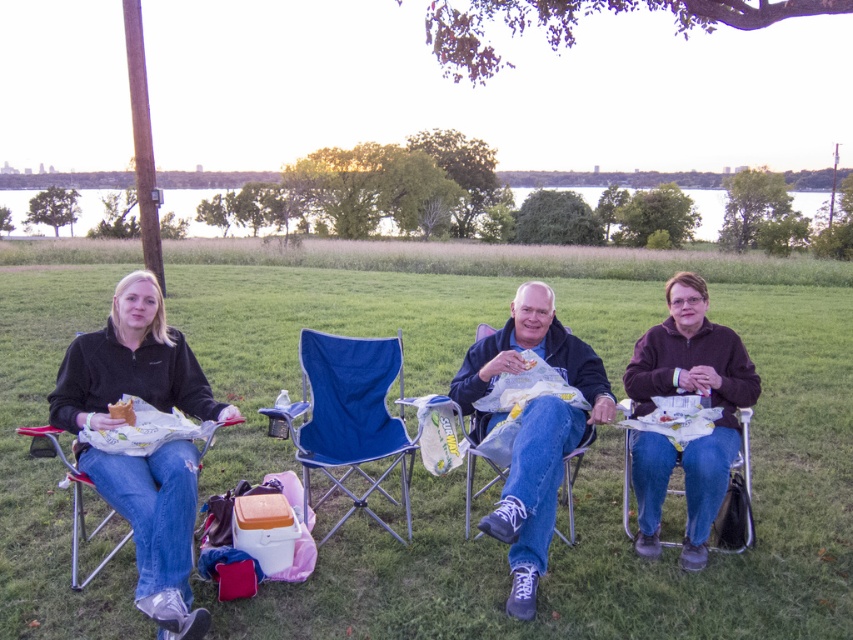
You are planning to take a photo of the dark blue fabric jacket at center and the golden crispy chicken at left. Which object should you focus on first if you want to capture both in the same frame without moving the camera?

The dark blue fabric jacket at center is wider than the golden crispy chicken at left, so you should focus on the golden crispy chicken at left first to ensure it fits within the frame.

You are standing at the center of the field and want to find the black fleece jacket at left. Which direction should you look to locate it?

You should look to your left to locate the black fleece jacket at left since it is positioned at point (131,364), which is to the left of the center.